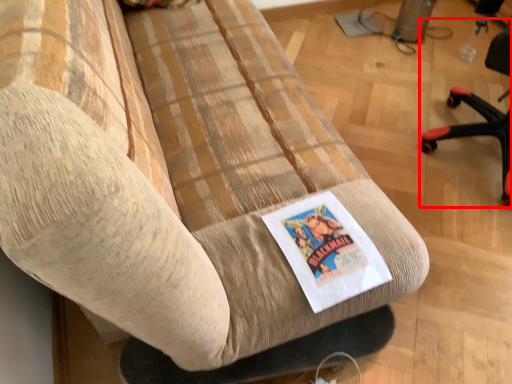
Question: From the image's perspective, what is the correct spatial relationship of chair (annotated by the red box) in relation to flyer?

Choices:
 (A) above
 (B) below

Answer: (A)